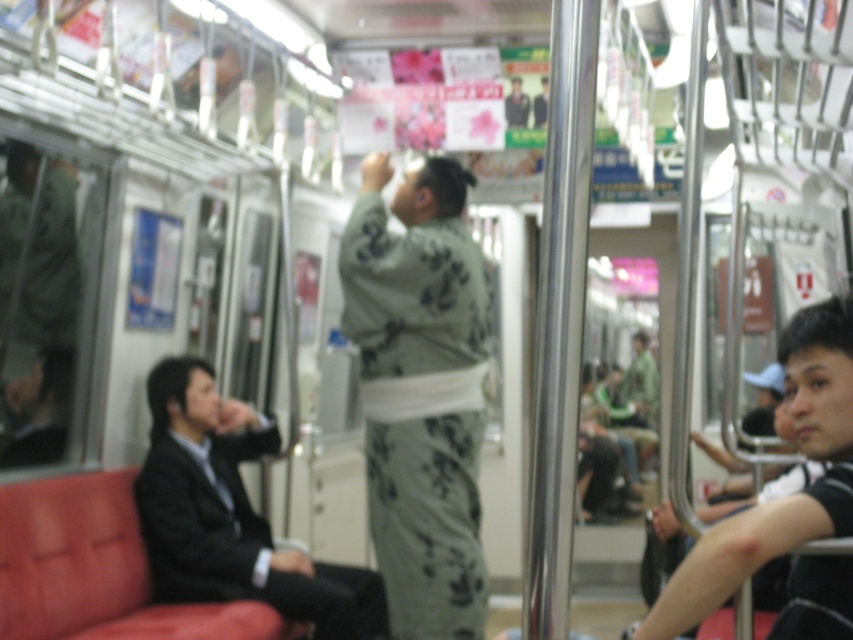
Question: Which of the following is the farthest from the observer?

Choices:
 (A) matte black shirt at right
 (B) dark blue uniform at center
 (C) black suit at left

Answer: (B)

Question: Based on their relative distances, which object is nearer to the black suit at left?

Choices:
 (A) dark blue uniform at center
 (B) matte black shirt at right

Answer: (A)

Question: Considering the relative positions of matte black shirt at right and dark blue uniform at center in the image provided, where is matte black shirt at right located with respect to dark blue uniform at center?

Choices:
 (A) above
 (B) below

Answer: (B)

Question: Can you confirm if light green kimono at center is thinner than dark blue uniform at center?

Choices:
 (A) no
 (B) yes

Answer: (A)

Question: Can you confirm if matte black shirt at right is positioned to the right of dark blue uniform at center?

Choices:
 (A) yes
 (B) no

Answer: (A)

Question: Which of the following is the farthest from the observer?

Choices:
 (A) (821, 419)
 (B) (219, 525)
 (C) (514, 93)

Answer: (C)